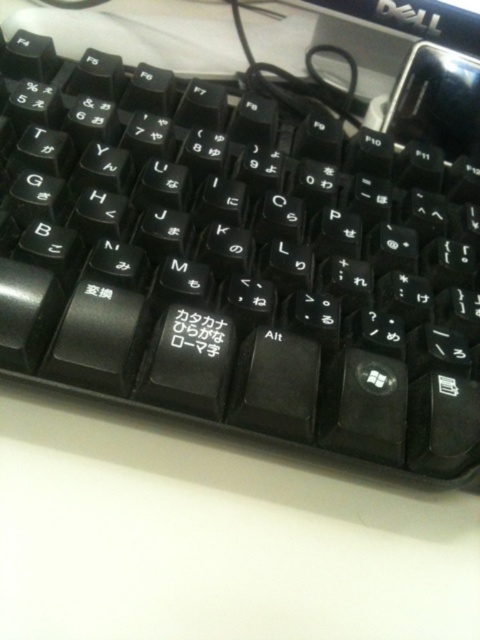
Question: Can you confirm if black matte text at center is positioned to the right of black plastic logo at upper center?

Choices:
 (A) yes
 (B) no

Answer: (B)

Question: Can you confirm if black matte text at center is bigger than black plastic logo at upper center?

Choices:
 (A) no
 (B) yes

Answer: (A)

Question: Which point appears farthest from the camera in this image?

Choices:
 (A) (427, 20)
 (B) (120, 61)
 (C) (199, 312)

Answer: (A)

Question: In this image, where is black plastic keyboard at center located relative to black matte text at center?

Choices:
 (A) left
 (B) right

Answer: (B)

Question: Among these objects, which one is nearest to the camera?

Choices:
 (A) black plastic keyboard at center
 (B) black matte text at center

Answer: (A)

Question: Which point is farther to the camera?

Choices:
 (A) black plastic logo at upper center
 (B) black plastic keyboard at center

Answer: (A)